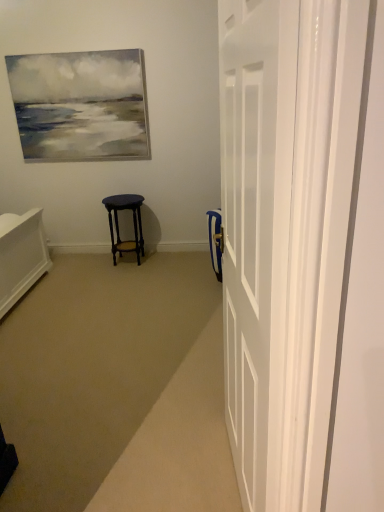
Question: Should I look upward or downward to see matte dark wood stool at center?

Choices:
 (A) down
 (B) up

Answer: (B)

Question: Is matte dark wood stool at center at the right side of white glossy door at right?

Choices:
 (A) no
 (B) yes

Answer: (A)

Question: Is matte dark wood stool at center oriented towards white glossy door at right?

Choices:
 (A) no
 (B) yes

Answer: (A)

Question: Does matte dark wood stool at center have a greater height compared to white glossy door at right?

Choices:
 (A) no
 (B) yes

Answer: (A)

Question: Considering the relative sizes of matte dark wood stool at center and white glossy door at right in the image provided, is matte dark wood stool at center smaller than white glossy door at right?

Choices:
 (A) no
 (B) yes

Answer: (B)

Question: Considering the relative sizes of matte dark wood stool at center and white glossy door at right in the image provided, is matte dark wood stool at center shorter than white glossy door at right?

Choices:
 (A) no
 (B) yes

Answer: (B)

Question: From the image's perspective, is matte dark wood stool at center on top of white glossy door at right?

Choices:
 (A) no
 (B) yes

Answer: (B)

Question: Is white glossy door at right to the right of matte dark wood stool at center from the viewer's perspective?

Choices:
 (A) yes
 (B) no

Answer: (A)

Question: Is white glossy door at right positioned with its back to matte dark wood stool at center?

Choices:
 (A) no
 (B) yes

Answer: (A)

Question: Is white glossy door at right wider than matte dark wood stool at center?

Choices:
 (A) yes
 (B) no

Answer: (B)

Question: Considering the relative positions of white glossy door at right and matte dark wood stool at center in the image provided, is white glossy door at right behind matte dark wood stool at center?

Choices:
 (A) no
 (B) yes

Answer: (A)

Question: Is white glossy door at right positioned in front of matte dark wood stool at center?

Choices:
 (A) no
 (B) yes

Answer: (B)

Question: Could you tell me if white glossy door at right is facing matte dark wood stool at center?

Choices:
 (A) no
 (B) yes

Answer: (A)

Question: Which is correct: matte dark wood stool at center is inside white glossy door at right, or outside of it?

Choices:
 (A) inside
 (B) outside

Answer: (B)